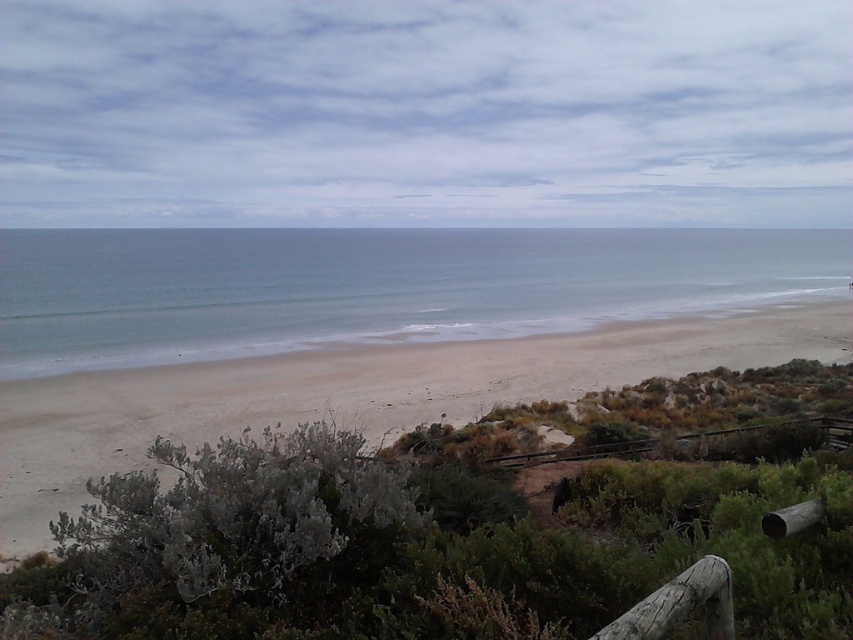
Does blue smooth water at center have a greater width compared to light brown sand at center?

Correct, the width of blue smooth water at center exceeds that of light brown sand at center.

Is point (465, 256) positioned in front of point (33, 509)?

No.

Where is `blue smooth water at center`? blue smooth water at center is located at coordinates (374, 285).